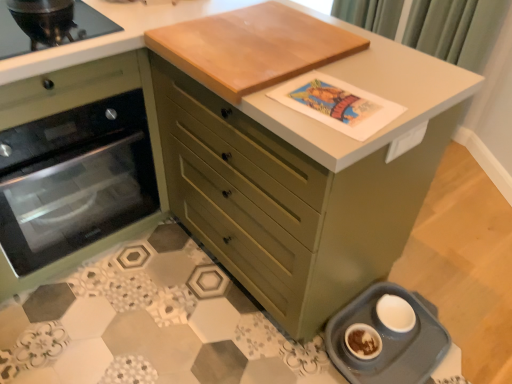
Question: Is green fabric curtain at upper right at the left side of matte green oven at left?

Choices:
 (A) no
 (B) yes

Answer: (A)

Question: From the image's perspective, is green fabric curtain at upper right located above matte green oven at left?

Choices:
 (A) yes
 (B) no

Answer: (A)

Question: Is green fabric curtain at upper right outside matte green oven at left?

Choices:
 (A) yes
 (B) no

Answer: (A)

Question: Is green fabric curtain at upper right touching matte green oven at left?

Choices:
 (A) no
 (B) yes

Answer: (A)

Question: From the image's perspective, does green fabric curtain at upper right appear lower than matte green oven at left?

Choices:
 (A) yes
 (B) no

Answer: (B)

Question: In terms of width, does gray plastic pet feeder at lower right look wider or thinner when compared to green fabric curtain at upper right?

Choices:
 (A) thin
 (B) wide

Answer: (B)

Question: Would you say gray plastic pet feeder at lower right is to the left or to the right of green fabric curtain at upper right in the picture?

Choices:
 (A) left
 (B) right

Answer: (A)

Question: From the image's perspective, is gray plastic pet feeder at lower right positioned above or below green fabric curtain at upper right?

Choices:
 (A) above
 (B) below

Answer: (B)

Question: Based on their sizes in the image, would you say gray plastic pet feeder at lower right is bigger or smaller than green fabric curtain at upper right?

Choices:
 (A) big
 (B) small

Answer: (B)

Question: Is matte green chest of drawers at center inside the boundaries of light brown wood cutting board at upper center, or outside?

Choices:
 (A) inside
 (B) outside

Answer: (B)

Question: From a real-world perspective, is matte green chest of drawers at center above or below light brown wood cutting board at upper center?

Choices:
 (A) below
 (B) above

Answer: (A)

Question: From the image's perspective, is matte green chest of drawers at center above or below light brown wood cutting board at upper center?

Choices:
 (A) above
 (B) below

Answer: (B)

Question: In terms of size, does matte green chest of drawers at center appear bigger or smaller than light brown wood cutting board at upper center?

Choices:
 (A) small
 (B) big

Answer: (B)

Question: Considering the positions of matte green chest of drawers at center and gray plastic pet feeder at lower right in the image, is matte green chest of drawers at center taller or shorter than gray plastic pet feeder at lower right?

Choices:
 (A) tall
 (B) short

Answer: (A)

Question: Considering the positions of matte green chest of drawers at center and gray plastic pet feeder at lower right in the image, is matte green chest of drawers at center wider or thinner than gray plastic pet feeder at lower right?

Choices:
 (A) wide
 (B) thin

Answer: (A)